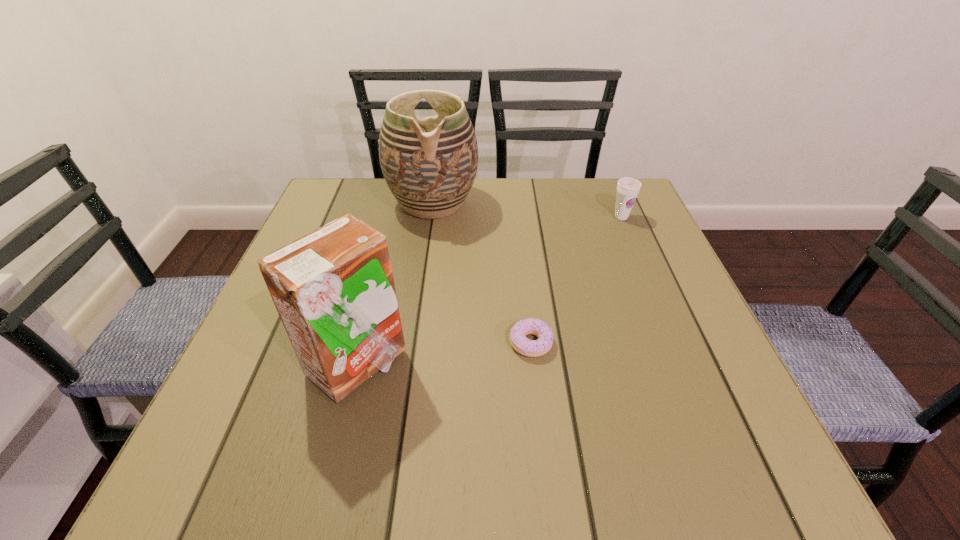
Identify the location of vacant space that is in between the doughnut and the carton. (444, 354).

The height and width of the screenshot is (540, 960). I want to click on unoccupied area between the second object from right to left and the carton, so click(444, 354).

Locate an element on the screen. Image resolution: width=960 pixels, height=540 pixels. vacant space that's between the doughnut and the pottery is located at coordinates (482, 273).

Where is `empty location between the doughnut and the rightmost object`? This screenshot has height=540, width=960. empty location between the doughnut and the rightmost object is located at coordinates (576, 280).

Locate an element on the screen. The width and height of the screenshot is (960, 540). vacant point located between the second shortest object and the pottery is located at coordinates (527, 210).

At what (x,y) coordinates should I click in order to perform the action: click on vacant space in between the third tallest object and the pottery. Please return your answer as a coordinate pair (x, y). The height and width of the screenshot is (540, 960). Looking at the image, I should click on (527, 210).

The image size is (960, 540). In order to click on blank region between the pottery and the cup in this screenshot , I will do `click(527, 210)`.

Locate an element on the screen. vacant region between the pottery and the third tallest object is located at coordinates (527, 210).

Image resolution: width=960 pixels, height=540 pixels. Find the location of `object identified as the third closest to the carton`. object identified as the third closest to the carton is located at coordinates (628, 188).

Identify which object is the nearest to the third tallest object. Please provide its 2D coordinates. Your answer should be formatted as a tuple, i.e. [(x, y)], where the tuple contains the x and y coordinates of a point satisfying the conditions above.

[(429, 164)]